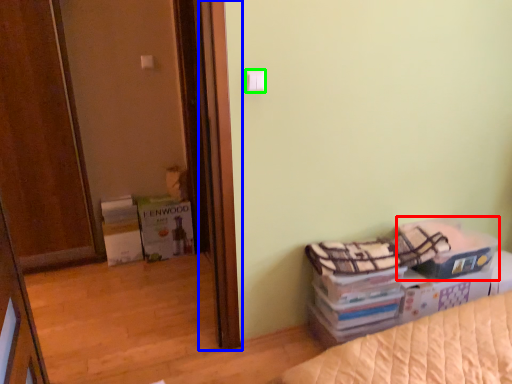
Question: Estimate the real-world distances between objects in this image. Which object is farther from storage box (highlighted by a red box), screen door (highlighted by a blue box) or light switch (highlighted by a green box)?

Choices:
 (A) screen door
 (B) light switch

Answer: (B)